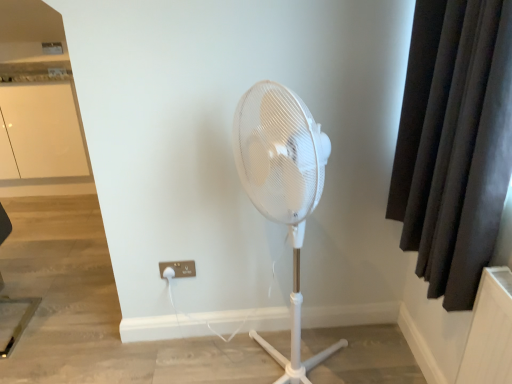
Question: In terms of size, does white glossy cabinet at upper left appear bigger or smaller than dark fabric curtain at right?

Choices:
 (A) small
 (B) big

Answer: (B)

Question: Is white glossy cabinet at upper left in front of or behind dark fabric curtain at right in the image?

Choices:
 (A) front
 (B) behind

Answer: (B)

Question: Which of these objects is positioned farthest from the white glossy cabinet at upper left?

Choices:
 (A) dark fabric curtain at right
 (B) white plastic electric outlet at lower center

Answer: (A)

Question: Considering the real-world distances, which object is closest to the white glossy cabinet at upper left?

Choices:
 (A) white plastic electric outlet at lower center
 (B) dark fabric curtain at right

Answer: (A)